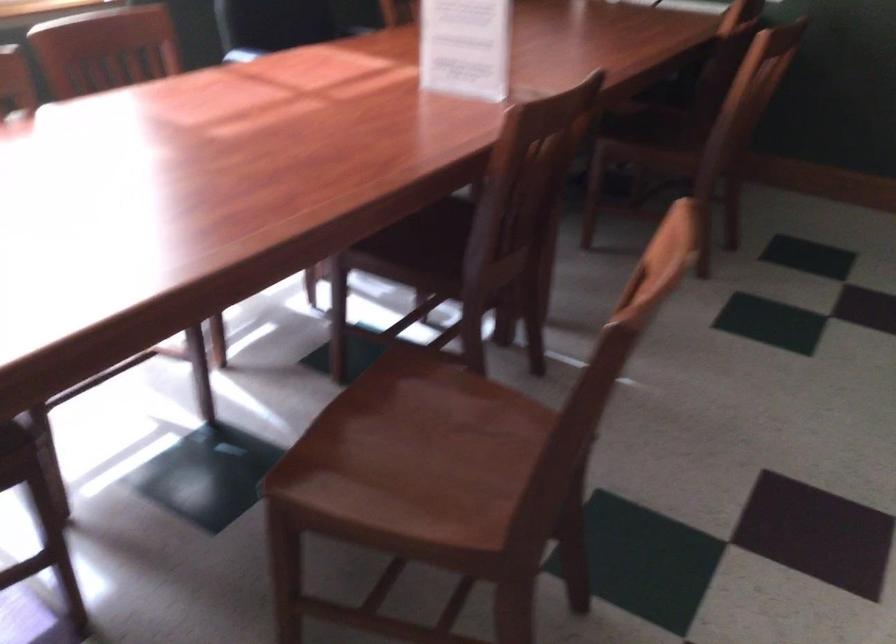
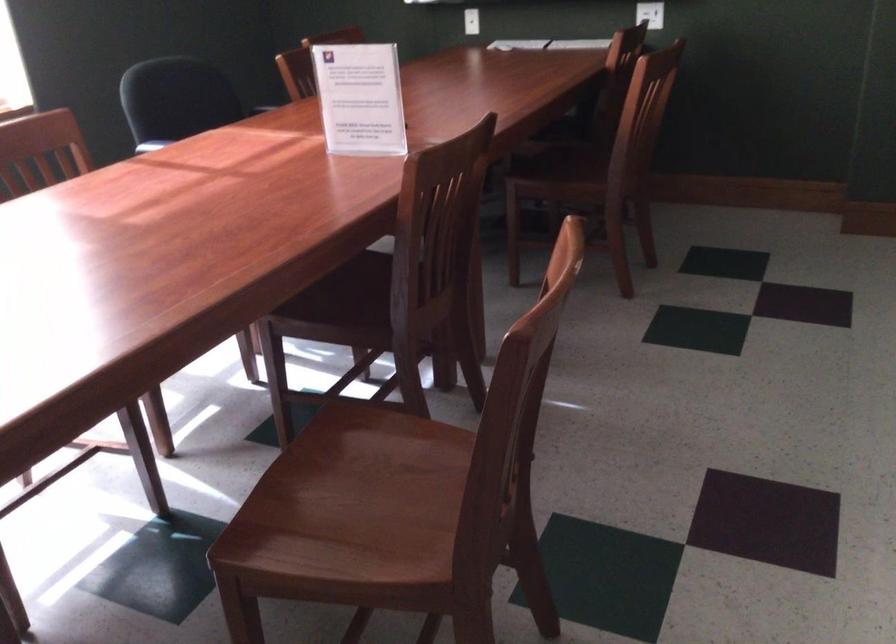
Find the pixel in the second image that matches (415,242) in the first image.

(340, 301)